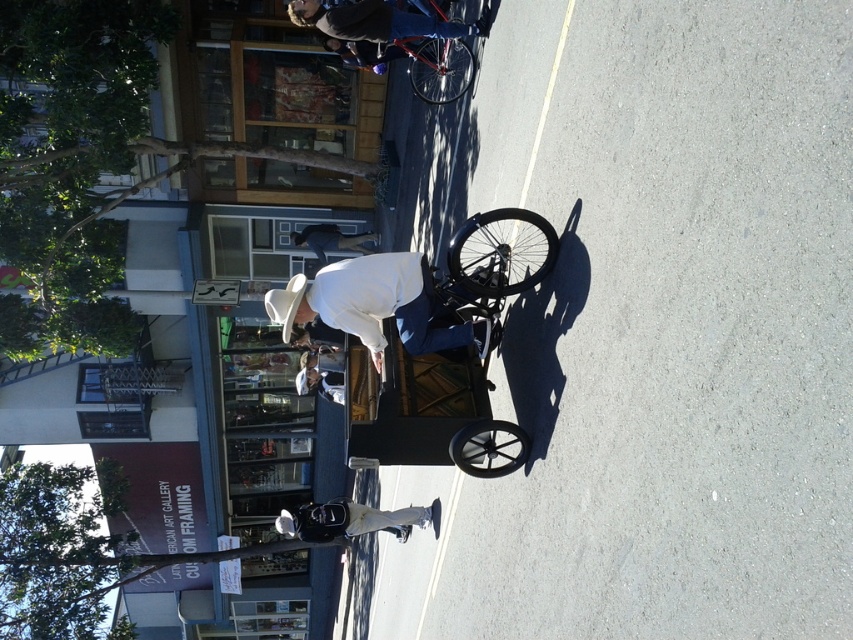
You are standing on the street and looking at the white matte hat at upper center and the white matte cowboy hat at lower center. Which hat is positioned to the right of the other?

The white matte hat at upper center is to the right of the white matte cowboy hat at lower center.

You are a delivery person who needs to park your metallic blue bicycle at upper center and dark blue jeans at center in a specific spot. Which object should be placed first to avoid blocking the other?

The metallic blue bicycle at upper center should be placed first because it is positioned over the dark blue jeans at center, meaning placing the bicycle first would block access to the jeans. To avoid blocking, place the dark blue jeans at center first before positioning the metallic blue bicycle at upper center over it.